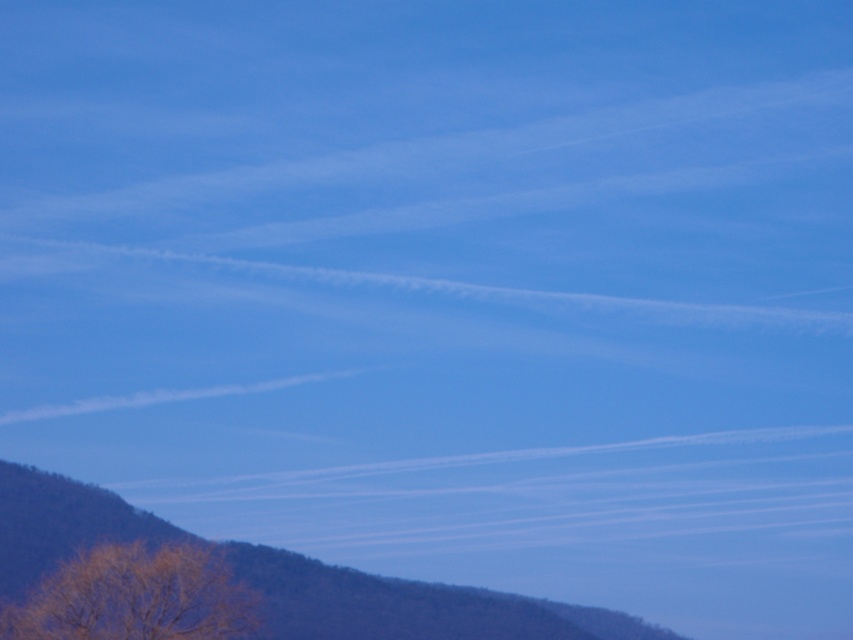
Does brown textured mountain at lower left have a larger size compared to brown textured tree at lower left?

Yes.

Can you confirm if brown textured mountain at lower left is wider than brown textured tree at lower left?

Yes.

Is point (328, 624) farther from camera compared to point (160, 570)?

Yes.

Find the location of a particular element. The image size is (853, 640). brown textured mountain at lower left is located at coordinates (407, 605).